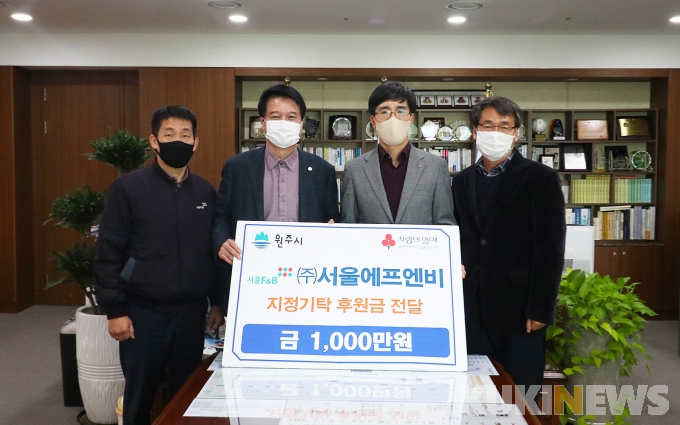
Locate an element on the screen. Image resolution: width=680 pixels, height=425 pixels. large white potted plant is located at coordinates (90, 326).